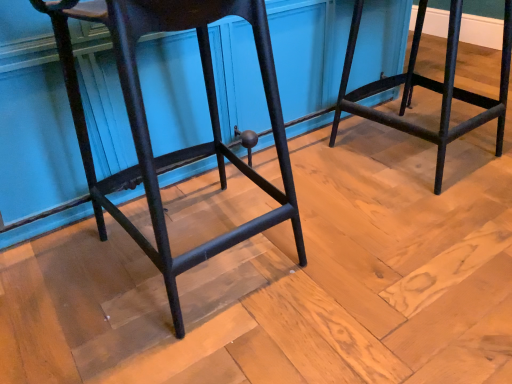
Question: Which direction should I rotate to look at matte black stool at center, which is counted as the first furniture, starting from the left?

Choices:
 (A) right
 (B) left

Answer: (B)

Question: Can black metal stool at right, the second furniture viewed from the left, be found inside matte black stool at center, the 2th furniture from the right?

Choices:
 (A) no
 (B) yes

Answer: (A)

Question: Considering the relative sizes of matte black stool at center, the 2th furniture from the right, and black metal stool at right, which ranks as the first furniture in right-to-left order, in the image provided, is matte black stool at center, the 2th furniture from the right, wider than black metal stool at right, which ranks as the first furniture in right-to-left order,?

Choices:
 (A) yes
 (B) no

Answer: (B)

Question: Could you tell me if matte black stool at center, which is counted as the first furniture, starting from the left, is facing black metal stool at right, the second furniture viewed from the left?

Choices:
 (A) yes
 (B) no

Answer: (B)

Question: Does matte black stool at center, which is counted as the first furniture, starting from the left, have a larger size compared to black metal stool at right, which ranks as the first furniture in right-to-left order?

Choices:
 (A) no
 (B) yes

Answer: (B)

Question: From a real-world perspective, is matte black stool at center, the 2th furniture from the right, over black metal stool at right, which ranks as the first furniture in right-to-left order?

Choices:
 (A) yes
 (B) no

Answer: (A)

Question: Is matte black stool at center, the 2th furniture from the right, positioned far away from black metal stool at right, which ranks as the first furniture in right-to-left order?

Choices:
 (A) no
 (B) yes

Answer: (A)

Question: Can you confirm if black metal stool at right, which ranks as the first furniture in right-to-left order, is taller than matte black stool at center, the 2th furniture from the right?

Choices:
 (A) no
 (B) yes

Answer: (A)

Question: Are black metal stool at right, which ranks as the first furniture in right-to-left order, and matte black stool at center, which is counted as the first furniture, starting from the left, far apart?

Choices:
 (A) no
 (B) yes

Answer: (A)

Question: Is black metal stool at right, the second furniture viewed from the left, turned away from matte black stool at center, the 2th furniture from the right?

Choices:
 (A) no
 (B) yes

Answer: (A)

Question: Considering the relative positions of black metal stool at right, the second furniture viewed from the left, and matte black stool at center, the 2th furniture from the right, in the image provided, is black metal stool at right, the second furniture viewed from the left, in front of matte black stool at center, the 2th furniture from the right,?

Choices:
 (A) no
 (B) yes

Answer: (A)

Question: From the image's perspective, is black metal stool at right, the second furniture viewed from the left, under matte black stool at center, which is counted as the first furniture, starting from the left?

Choices:
 (A) no
 (B) yes

Answer: (A)

Question: Can you confirm if black metal stool at right, the second furniture viewed from the left, is thinner than matte black stool at center, which is counted as the first furniture, starting from the left?

Choices:
 (A) no
 (B) yes

Answer: (A)

Question: From a real-world perspective, is black metal stool at right, which ranks as the first furniture in right-to-left order, physically located above or below matte black stool at center, the 2th furniture from the right?

Choices:
 (A) below
 (B) above

Answer: (A)